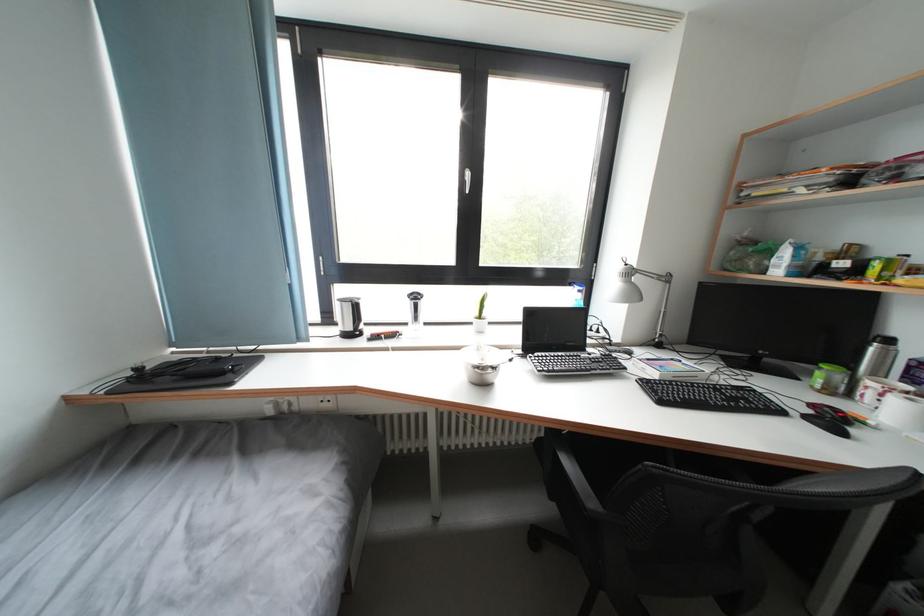
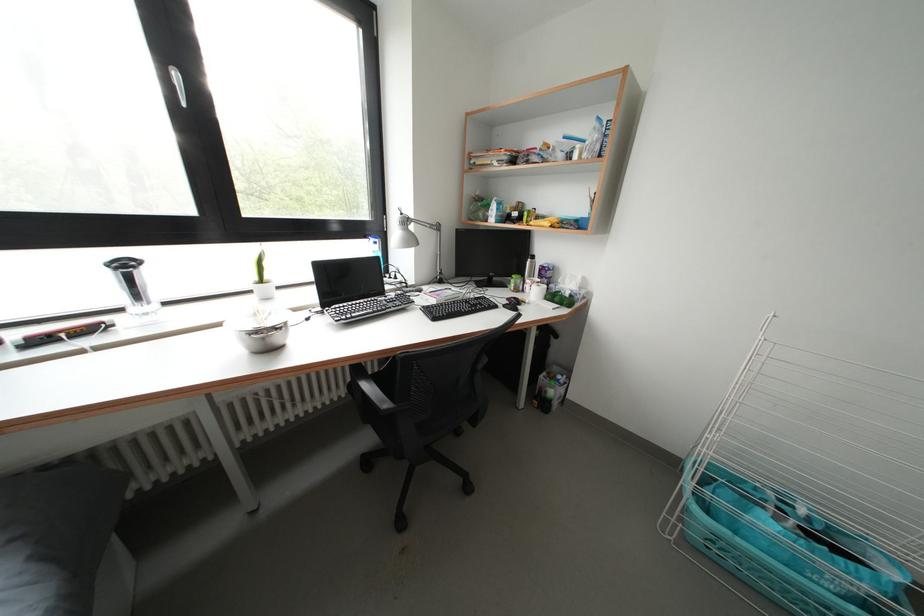
Find the pixel in the second image that matches (485,371) in the first image.

(262, 337)